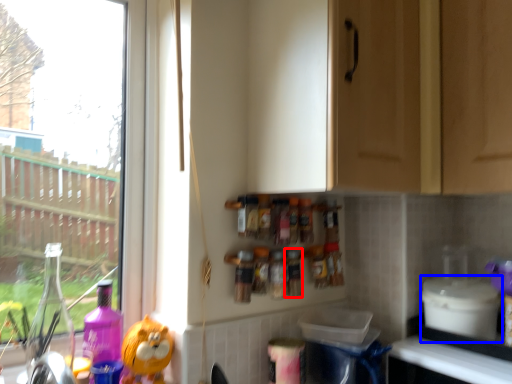
Question: Which object is closer to the camera taking this photo, bottle (highlighted by a red box) or appliance (highlighted by a blue box)?

Choices:
 (A) bottle
 (B) appliance

Answer: (B)